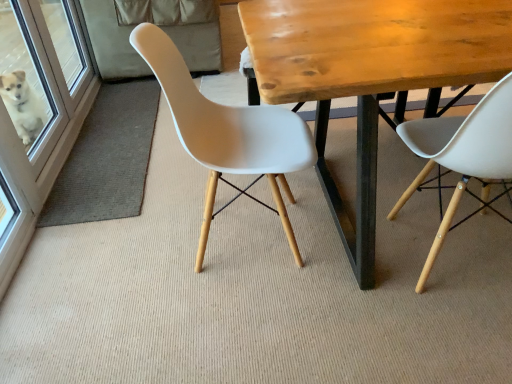
Where is `free space that is in between white plastic chair at center, the 1th chair positioned from the left, and wooden table at center`? Image resolution: width=512 pixels, height=384 pixels. free space that is in between white plastic chair at center, the 1th chair positioned from the left, and wooden table at center is located at coordinates [x=232, y=233].